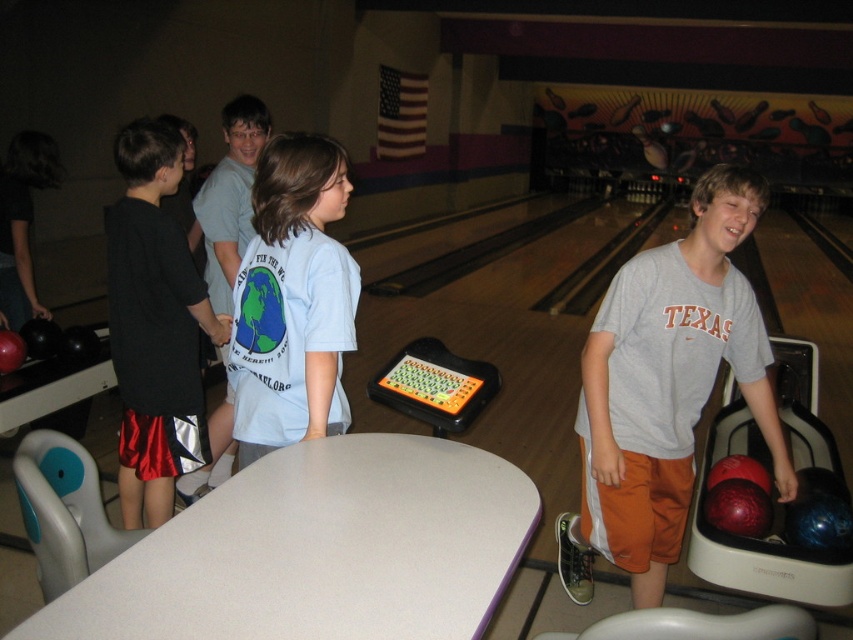
Between point (345, 182) and point (135, 499), which one is positioned behind?

The point (135, 499) is behind.

The image size is (853, 640). Describe the element at coordinates (293, 300) in the screenshot. I see `light blue cotton shirt at center` at that location.

Where is `light blue cotton shirt at center`? light blue cotton shirt at center is located at coordinates (293, 300).

Measure the distance between white matte table at center and light blue cotton shirt at center.

white matte table at center is 17.26 inches from light blue cotton shirt at center.

Is white matte table at center positioned in front of light blue cotton shirt at center?

That is True.

Between point (300, 554) and point (315, 253), which one is positioned behind?

Positioned behind is point (315, 253).

This screenshot has width=853, height=640. In order to click on white matte table at center in this screenshot , I will do `click(318, 550)`.

Who is higher up, gray cotton t-shirt at center or light blue cotton shirt at center?

light blue cotton shirt at center is higher up.

This screenshot has height=640, width=853. Describe the element at coordinates (665, 388) in the screenshot. I see `gray cotton t-shirt at center` at that location.

The image size is (853, 640). I want to click on gray cotton t-shirt at center, so click(x=665, y=388).